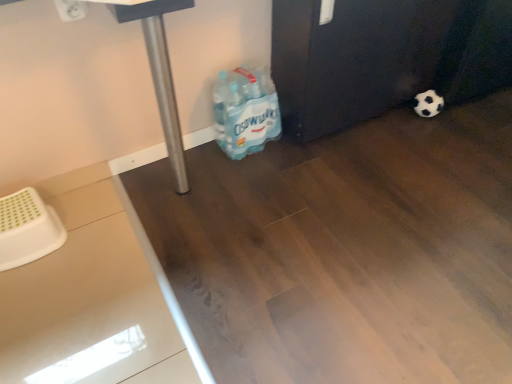
Identify the location of free space that is to the left of black and white textured football at lower right. Image resolution: width=512 pixels, height=384 pixels. (396, 113).